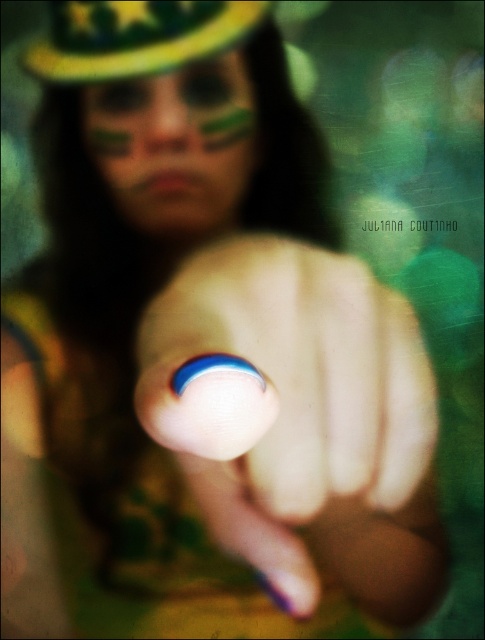
Question: Estimate the real-world distances between objects in this image. Which object is closer to the blue painted nail at center?

Choices:
 (A) yellow-green fabric hat at upper center
 (B) matte green paint at center

Answer: (B)

Question: Which point is farther to the camera?

Choices:
 (A) (151, 65)
 (B) (322, 365)
 (C) (196, 152)

Answer: (B)

Question: Is blue painted nail at center thinner than matte green paint at center?

Choices:
 (A) yes
 (B) no

Answer: (B)

Question: Can you confirm if blue painted nail at center is smaller than matte green paint at center?

Choices:
 (A) yes
 (B) no

Answer: (B)

Question: Which point appears closest to the camera in this image?

Choices:
 (A) (253, 109)
 (B) (188, 392)

Answer: (B)

Question: Is blue painted nail at center below yellow-green fabric hat at upper center?

Choices:
 (A) yes
 (B) no

Answer: (A)